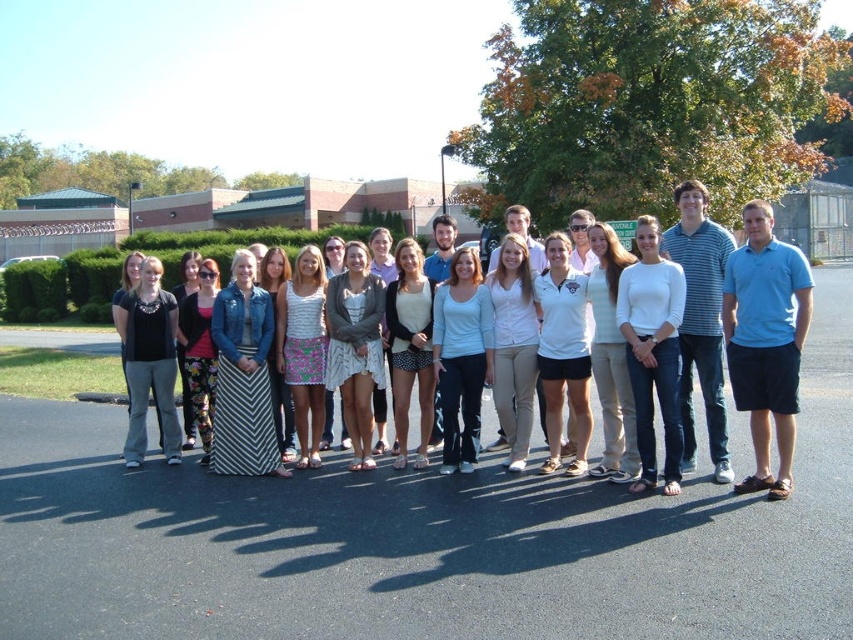
Question: Which object appears closest to the camera in this image?

Choices:
 (A) white cotton dress at center
 (B) blue cotton polo shirt at right
 (C) black asphalt at center

Answer: (C)

Question: Which point appears farthest from the camera in this image?

Choices:
 (A) (772, 349)
 (B) (712, 323)

Answer: (B)

Question: Can you confirm if white cotton dress at center is positioned below blue cotton polo shirt at right?

Choices:
 (A) no
 (B) yes

Answer: (A)

Question: Does black asphalt at center come in front of blue cotton polo shirt at right?

Choices:
 (A) no
 (B) yes

Answer: (B)

Question: Among these objects, which one is nearest to the camera?

Choices:
 (A) blue cotton polo shirt at right
 (B) black asphalt at center
 (C) white cotton dress at center

Answer: (B)

Question: Is black asphalt at center to the right of blue cotton polo shirt at right from the viewer's perspective?

Choices:
 (A) no
 (B) yes

Answer: (A)